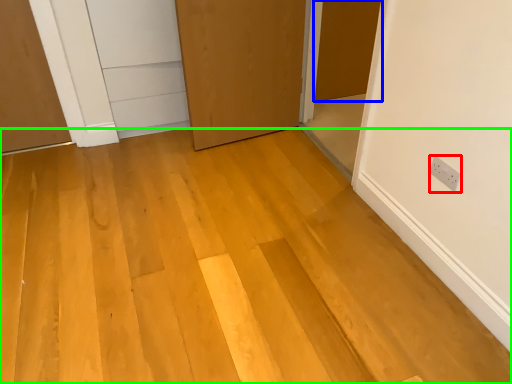
Question: Which object is the farthest from electric outlet (highlighted by a red box)? Choose among these: door (highlighted by a blue box) or plywood (highlighted by a green box).

Choices:
 (A) door
 (B) plywood

Answer: (A)